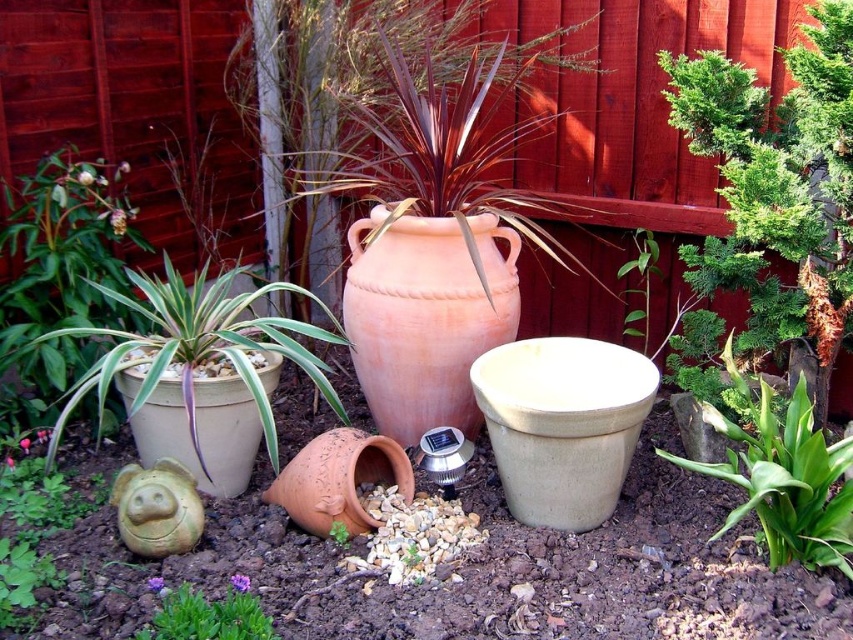
Question: Can you confirm if beige matte pot at center-right is thinner than green matte pot at left?

Choices:
 (A) yes
 (B) no

Answer: (A)

Question: Which of the following is the closest to the observer?

Choices:
 (A) (711, 429)
 (B) (61, 282)
 (C) (161, 412)
 (D) (343, 525)

Answer: (D)

Question: Which of the following is the closest to the observer?

Choices:
 (A) green matte succulent at center
 (B) terracotta pot at center

Answer: (A)

Question: Is terracotta pot at center bigger than green matte succulent at center?

Choices:
 (A) yes
 (B) no

Answer: (A)

Question: Is the position of terracotta clay pot at center more distant than that of green matte succulent at center?

Choices:
 (A) no
 (B) yes

Answer: (B)

Question: Which object is farther from the camera taking this photo?

Choices:
 (A) green matte succulent at center
 (B) beige matte pot at center-right

Answer: (A)